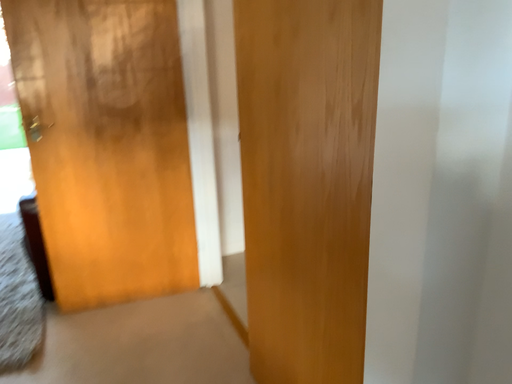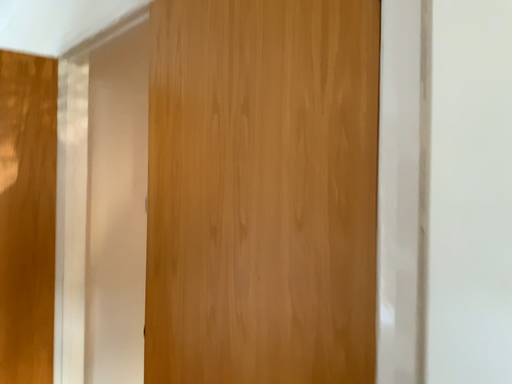
Question: How did the camera likely rotate when shooting the video?

Choices:
 (A) rotated right
 (B) rotated left

Answer: (A)